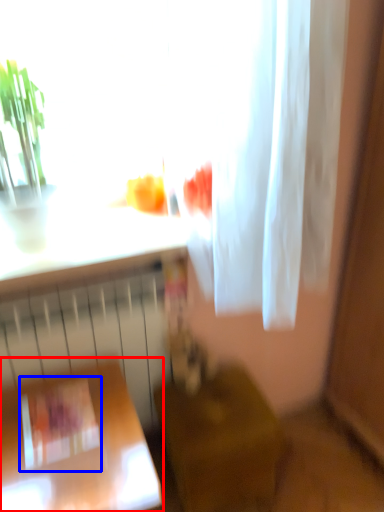
Question: Which point is closer to the camera, furniture (highlighted by a red box) or square (highlighted by a blue box)?

Choices:
 (A) furniture
 (B) square

Answer: (A)